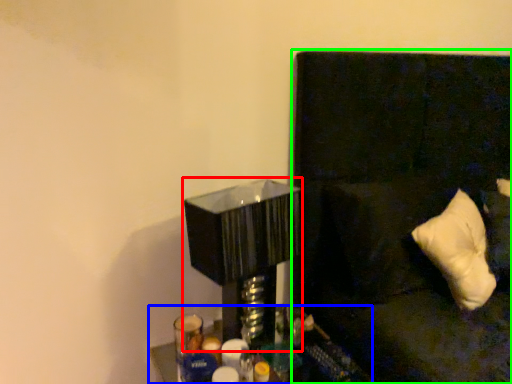
Question: Which object is the closest to the table lamp (highlighted by a red box)? Choose among these: furniture (highlighted by a blue box) or couch (highlighted by a green box).

Choices:
 (A) furniture
 (B) couch

Answer: (A)